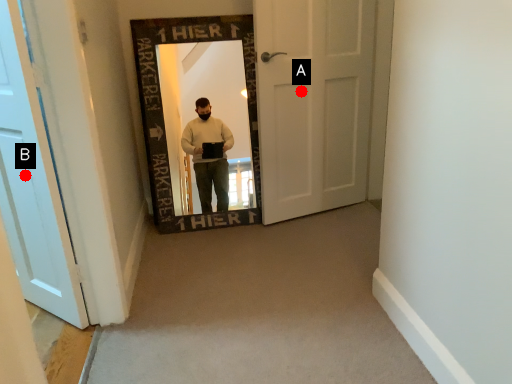
Question: Two points are circled on the image, labeled by A and B beside each circle. Which point appears closest to the camera in this image?

Choices:
 (A) A is closer
 (B) B is closer

Answer: (B)